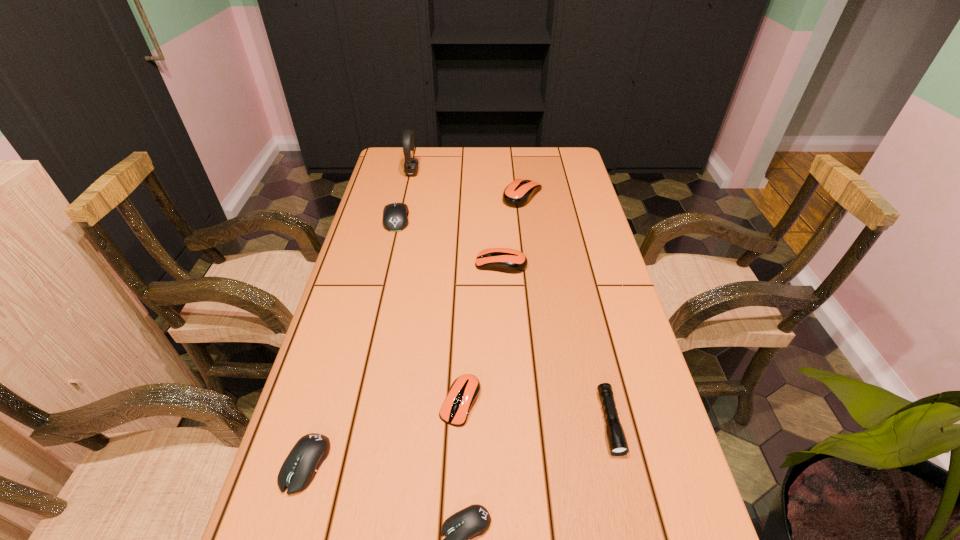
Locate an element on the screen. The image size is (960, 540). black computer equipment that stands as the second closest to the second smallest black computer equipment is located at coordinates (395, 215).

At what (x,y) coordinates should I click in order to perform the action: click on free location that satisfies the following two spatial constraints: 1. on the front-facing side of the tallest object; 2. on the back side of the second farthest orange computer mouse. Please return your answer as a coordinate pair (x, y). This screenshot has width=960, height=540. Looking at the image, I should click on (392, 264).

You are a GUI agent. You are given a task and a screenshot of the screen. Output one action in this format:
    pyautogui.click(x=<x>, y=<y>)
    Task: Click on the vacant region that satisfies the following two spatial constraints: 1. on the back side of the fourth farthest computer equipment; 2. on the front-facing side of the tallest object
    The height and width of the screenshot is (540, 960).
    Given the screenshot: What is the action you would take?
    pyautogui.click(x=468, y=173)

Where is `vacant space that satisfies the following two spatial constraints: 1. on the back side of the second smallest black computer equipment; 2. on the left side of the biggest orange computer mouse`? The height and width of the screenshot is (540, 960). vacant space that satisfies the following two spatial constraints: 1. on the back side of the second smallest black computer equipment; 2. on the left side of the biggest orange computer mouse is located at coordinates (384, 195).